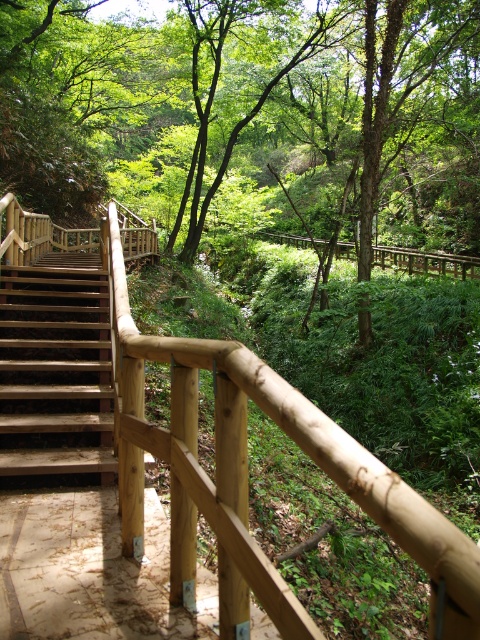
Question: Does green matte tree at upper center have a greater width compared to wooden stairs at left?

Choices:
 (A) yes
 (B) no

Answer: (A)

Question: Does green matte tree at upper center appear on the left side of natural wood handrail at center?

Choices:
 (A) no
 (B) yes

Answer: (A)

Question: Observing the image, what is the correct spatial positioning of natural wood handrail at center in reference to brown wooden path at lower left?

Choices:
 (A) left
 (B) right

Answer: (B)

Question: Which object is the closest to the natural wood handrail at center?

Choices:
 (A) wooden stairs at left
 (B) brown wooden path at lower left

Answer: (B)

Question: Which object appears farthest from the camera in this image?

Choices:
 (A) wooden stairs at left
 (B) green matte tree at upper center
 (C) brown wooden path at lower left

Answer: (B)

Question: Which point appears closest to the camera in this image?

Choices:
 (A) (335, 100)
 (B) (11, 634)

Answer: (B)